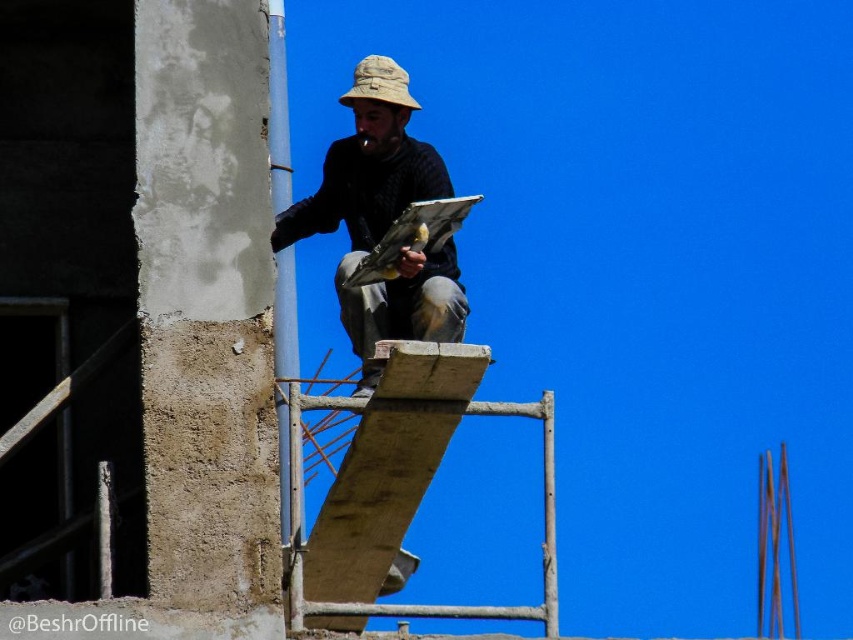
Is matte black shirt at center above tan fabric hat at center?

No.

Which of these two, matte black shirt at center or tan fabric hat at center, stands shorter?

tan fabric hat at center is shorter.

Is point (386, 300) farther from camera compared to point (381, 92)?

No.

The width and height of the screenshot is (853, 640). I want to click on matte black shirt at center, so click(381, 220).